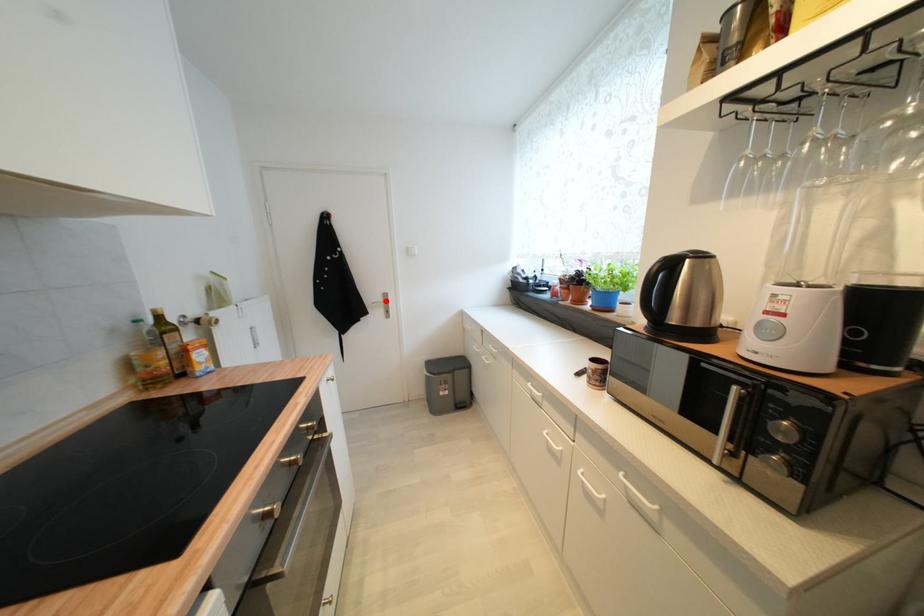
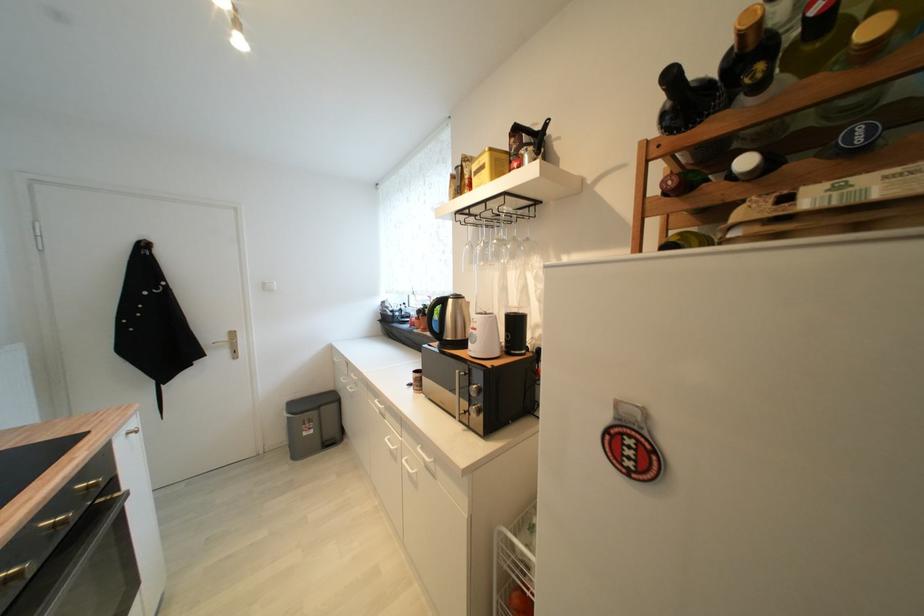
Where in the second image is the point corresponding to the highlighted location from the first image?

(229, 339)